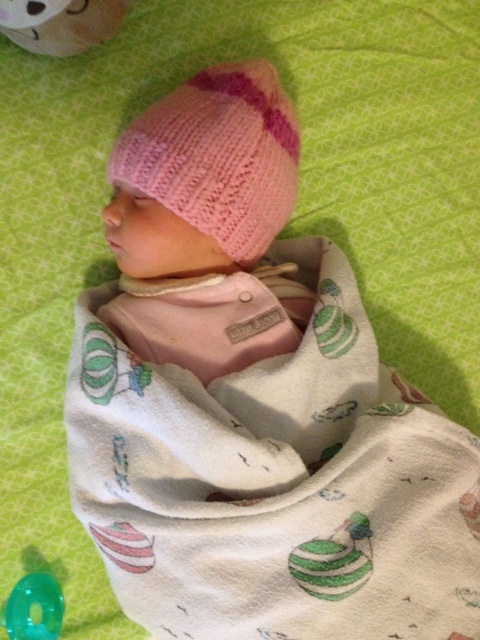
You are a photographer setting up for a baby photo shoot. You need to ensure that the white cotton swaddle at center and the pink knitted hat at upper center are both visible in the final shot. Based on their positions, which object will appear closer to the camera?

The white cotton swaddle at center is in front of the pink knitted hat at upper center, so it will appear closer to the camera in the photo.

You are a nurse preparing to swaddle a baby. You have two items in front of you, the white cotton swaddle at center and the translucent green ring at lower left. Which item should you choose for wrapping the baby?

You should choose the white cotton swaddle at center because it has a larger size compared to the translucent green ring at lower left, making it suitable for wrapping the baby.